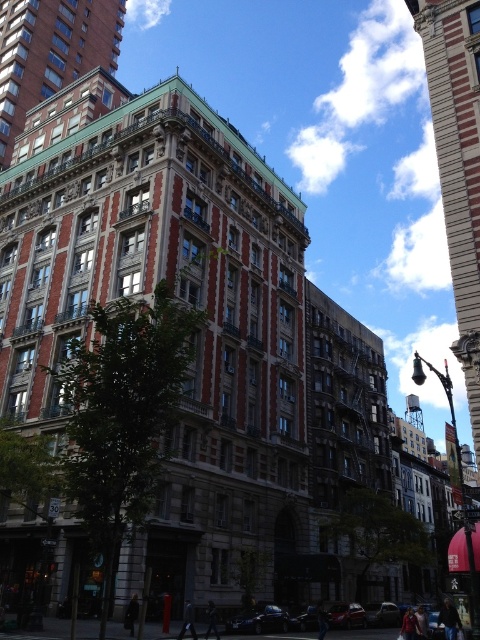
Consider the image. Based on the scene described, which building is wider, the brown stone building at center or the red brick building at upper left?

The brown stone building at center might be wider than the red brick building at upper left according to the description.